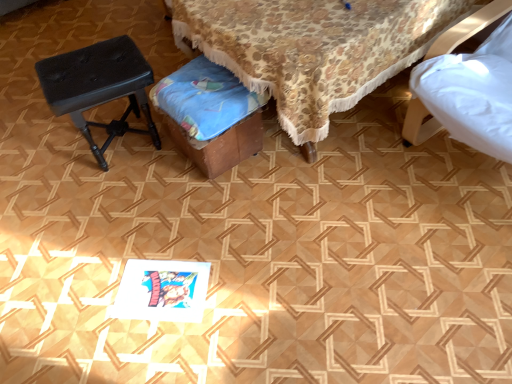
Question: From a real-world perspective, is black leather stool at left located beneath wooden music stool at center?

Choices:
 (A) yes
 (B) no

Answer: (B)

Question: Is black leather stool at left smaller than wooden music stool at center?

Choices:
 (A) yes
 (B) no

Answer: (B)

Question: Is black leather stool at left taller than wooden music stool at center?

Choices:
 (A) yes
 (B) no

Answer: (A)

Question: Considering the relative sizes of black leather stool at left and wooden music stool at center in the image provided, is black leather stool at left shorter than wooden music stool at center?

Choices:
 (A) no
 (B) yes

Answer: (A)

Question: Can you confirm if black leather stool at left is positioned to the right of wooden music stool at center?

Choices:
 (A) no
 (B) yes

Answer: (A)

Question: Considering the positions of black leather stool at left and wooden music stool at center in the image, is black leather stool at left taller or shorter than wooden music stool at center?

Choices:
 (A) tall
 (B) short

Answer: (A)

Question: From a real-world perspective, relative to wooden music stool at center, is black leather stool at left vertically above or below?

Choices:
 (A) below
 (B) above

Answer: (B)

Question: From the image's perspective, is black leather stool at left above or below wooden music stool at center?

Choices:
 (A) below
 (B) above

Answer: (B)

Question: In the image, is black leather stool at left on the left side or the right side of wooden music stool at center?

Choices:
 (A) left
 (B) right

Answer: (A)

Question: Considering the relative positions of wooden music stool at center and black leather stool at left in the image provided, is wooden music stool at center to the left or to the right of black leather stool at left?

Choices:
 (A) left
 (B) right

Answer: (B)

Question: Considering the positions of point (246, 91) and point (122, 132), is point (246, 91) closer or farther from the camera than point (122, 132)?

Choices:
 (A) closer
 (B) farther

Answer: (A)

Question: In terms of width, does wooden music stool at center look wider or thinner when compared to black leather stool at left?

Choices:
 (A) wide
 (B) thin

Answer: (B)

Question: From the image's perspective, relative to black leather stool at left, is wooden music stool at center above or below?

Choices:
 (A) below
 (B) above

Answer: (A)

Question: Is black leather stool at left bigger or smaller than wooden stool at center?

Choices:
 (A) small
 (B) big

Answer: (A)

Question: Is black leather stool at left taller or shorter than wooden stool at center?

Choices:
 (A) short
 (B) tall

Answer: (A)